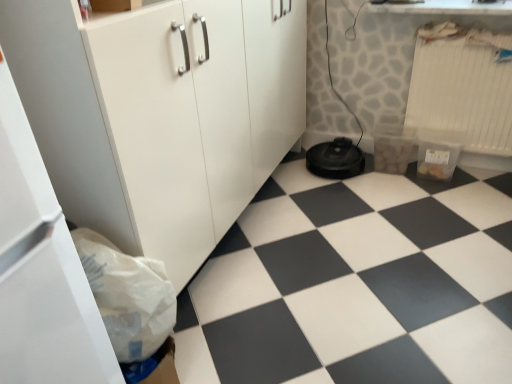
Find the location of a particular element. The image size is (512, 384). free space in front of black plastic robot vacuum cleaner at lower center is located at coordinates (347, 189).